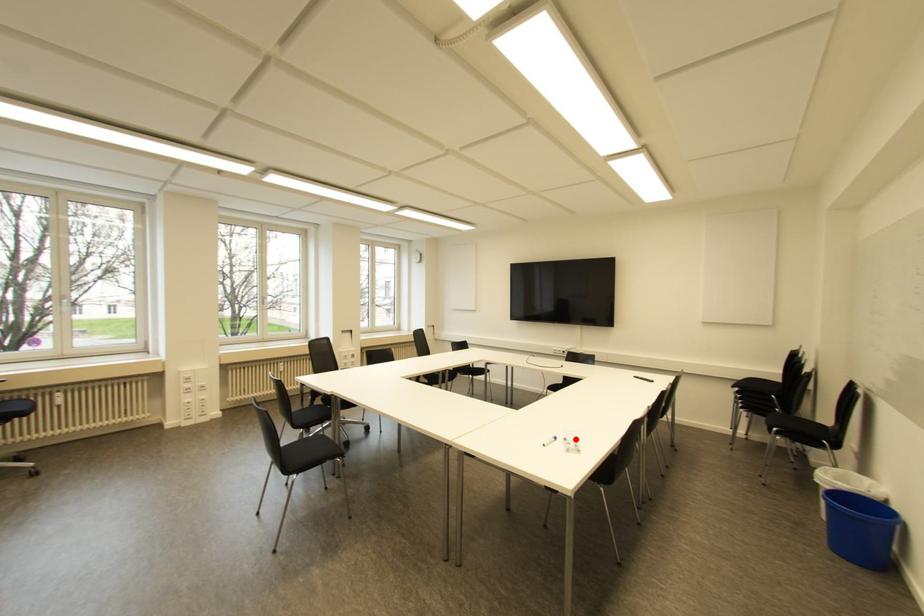
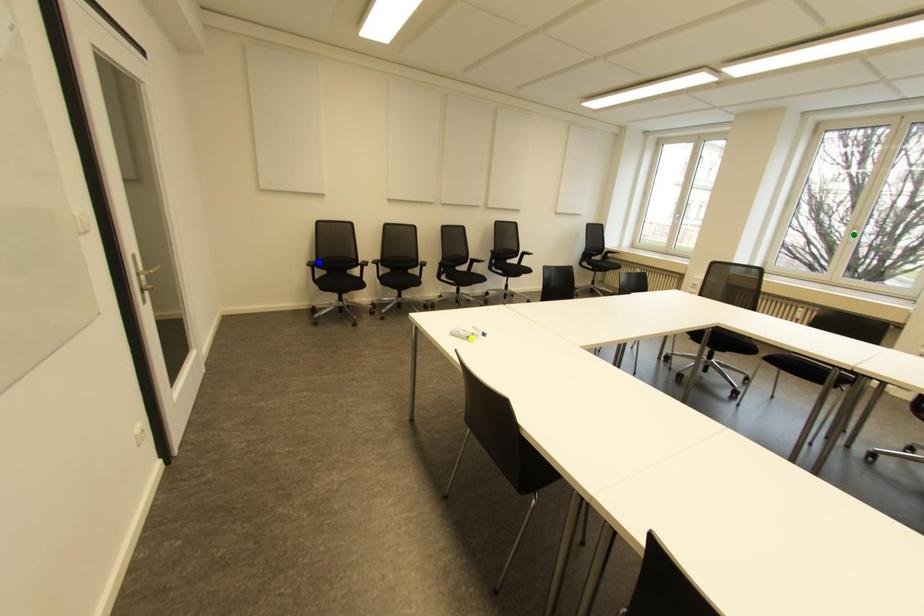
Question: I am providing you with two images of the same scene from different viewpoints. A red point is marked on the first image. You are given multiple points on the second image. Which spot in image 2 lines up with the point in image 1?

Choices:
 (A) yellow point
 (B) green point
 (C) blue point

Answer: (A)